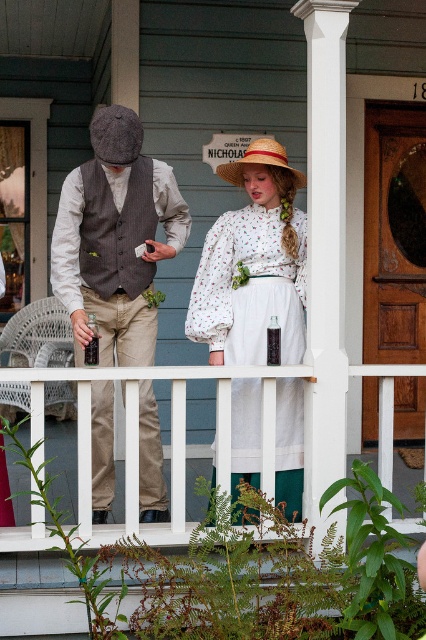
You are standing at the point labeled point (109, 256) on the porch. You want to take a photo of the sign that says Nicholas. Is the sign within your camera range if your camera can capture objects up to 6 meters away?

The distance between you and the viewer is 5.78 meters, which is within the camera range of 6 meters. Therefore, the sign should be visible in your photo.